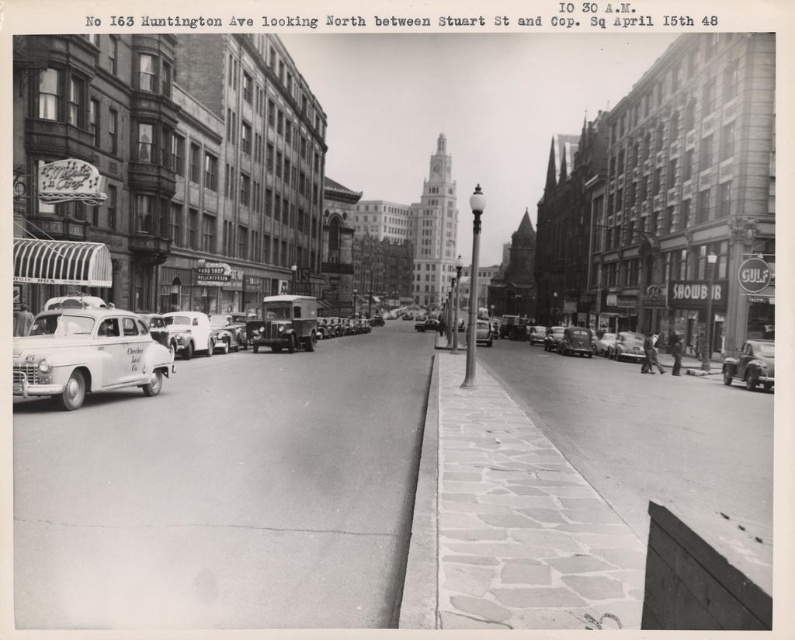
You are a pedestrian standing on the sidewalk and want to cross the street to reach the shiny silver car at right. Is the white matte taxi at left blocking your path?

The white matte taxi at left is positioned over the shiny silver car at right, meaning it is directly in front of it. Therefore, the white matte taxi at left is blocking your path to the shiny silver car at right.